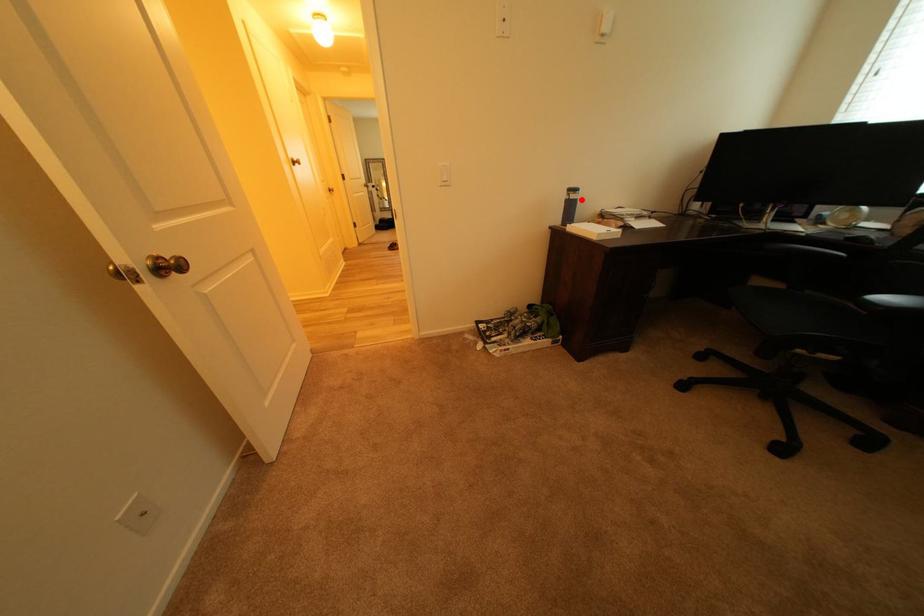
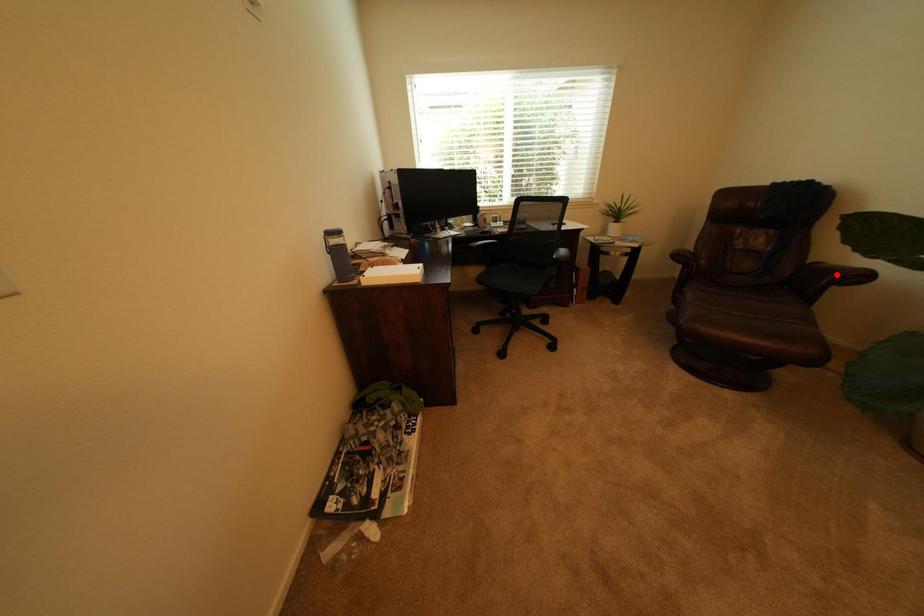
I am providing you with two images of the same scene from different viewpoints. A red point is marked on the first image and another point is marked on the second image. Is the marked point in image1 the same physical position as the marked point in image2?

No